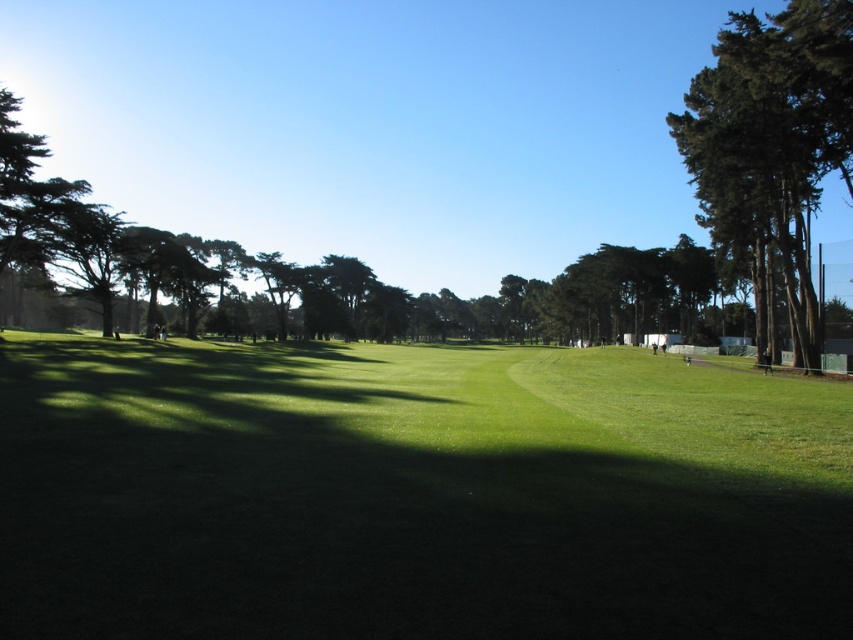
Is green grassy field at center wider than green textured tree at right?

In fact, green grassy field at center might be narrower than green textured tree at right.

Is green grassy field at center further to the viewer compared to green textured tree at right?

No, it is not.

Is point (788, 493) closer to viewer compared to point (795, 132)?

Yes, it is.

I want to click on green grassy field at center, so click(x=415, y=496).